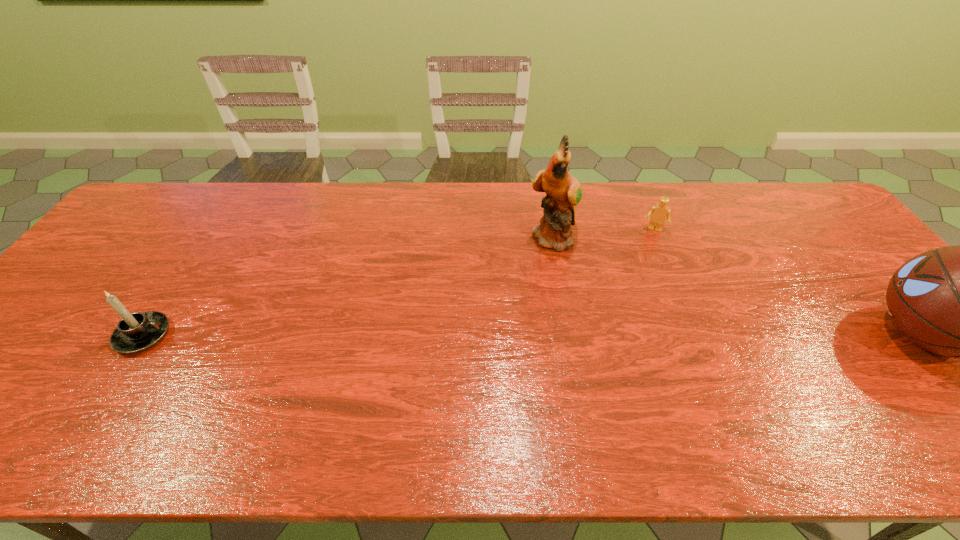
The height and width of the screenshot is (540, 960). I want to click on vacant space situated on the face of the shortest object, so click(642, 271).

You are a GUI agent. You are given a task and a screenshot of the screen. Output one action in this format:
    pyautogui.click(x=<x>, y=<y>)
    Task: Click on the vacant space located on the face of the shortest object
    
    Given the screenshot: What is the action you would take?
    pyautogui.click(x=635, y=306)

At what (x,y) coordinates should I click in order to perform the action: click on vacant space situated 0.290m on the face of the shortest object. Please return your answer as a coordinate pair (x, y). The image size is (960, 540). Looking at the image, I should click on (636, 301).

Where is `parrot that is at the far edge`? The image size is (960, 540). parrot that is at the far edge is located at coordinates (563, 192).

Where is `Lego present at the far edge`? This screenshot has width=960, height=540. Lego present at the far edge is located at coordinates (658, 213).

I want to click on blank space at the far edge of the desktop, so click(x=364, y=227).

Where is `free space at the near edge of the desktop`? The image size is (960, 540). free space at the near edge of the desktop is located at coordinates (202, 389).

At what (x,y) coordinates should I click in order to perform the action: click on free spot at the left edge of the desktop. Please return your answer as a coordinate pair (x, y). The image size is (960, 540). Looking at the image, I should click on (131, 240).

At what (x,y) coordinates should I click in order to perform the action: click on vacant region at the right edge of the desktop. Please return your answer as a coordinate pair (x, y). Looking at the image, I should click on (900, 368).

The image size is (960, 540). What are the coordinates of `free space at the far left corner of the desktop` in the screenshot? It's located at (195, 198).